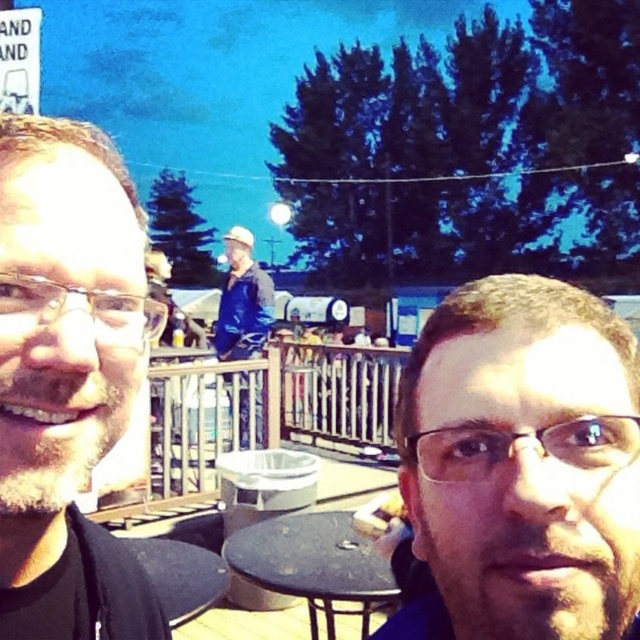
You are a photographer trying to capture a photo of the black matte face at left and the blue denim jacket at center. Based on their sizes in the image, which one would appear closer to the camera?

The black matte face at left has a smaller size compared to the blue denim jacket at center, so the blue denim jacket at center appears closer to the camera.